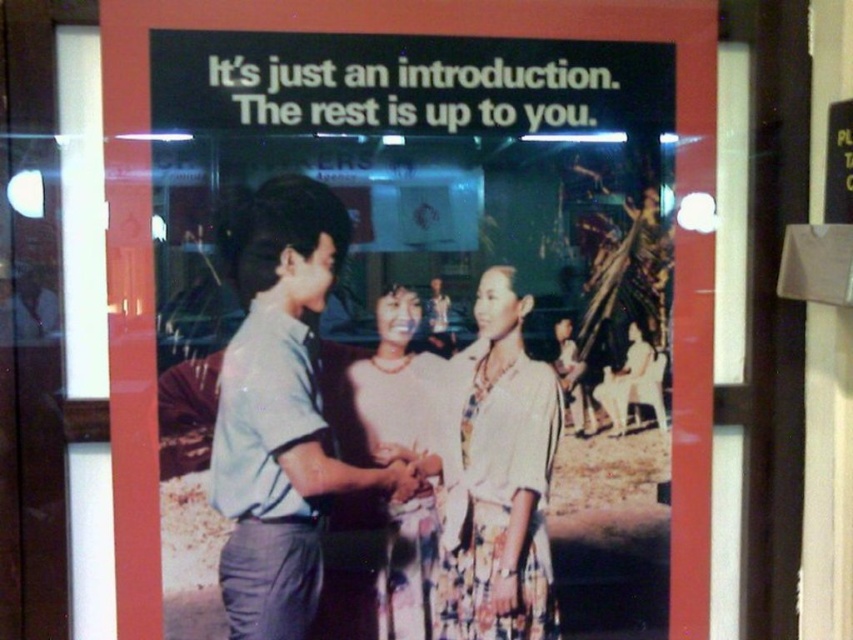
Question: Does light blue shirt at center have a larger size compared to printed silk blouse at center?

Choices:
 (A) no
 (B) yes

Answer: (B)

Question: Which point is closer to the camera taking this photo?

Choices:
 (A) (119, 348)
 (B) (396, 365)
 (C) (505, 460)
 (D) (287, 445)

Answer: (A)

Question: Which point is closer to the camera?

Choices:
 (A) matte white blouse at center
 (B) light blue shirt at center

Answer: (B)

Question: Can you confirm if matte paper poster at center is wider than printed silk blouse at center?

Choices:
 (A) no
 (B) yes

Answer: (B)

Question: Does light blue shirt at center have a lesser width compared to printed silk blouse at center?

Choices:
 (A) no
 (B) yes

Answer: (A)

Question: Among these objects, which one is farthest from the camera?

Choices:
 (A) light blue shirt at center
 (B) matte paper poster at center
 (C) printed silk blouse at center

Answer: (C)